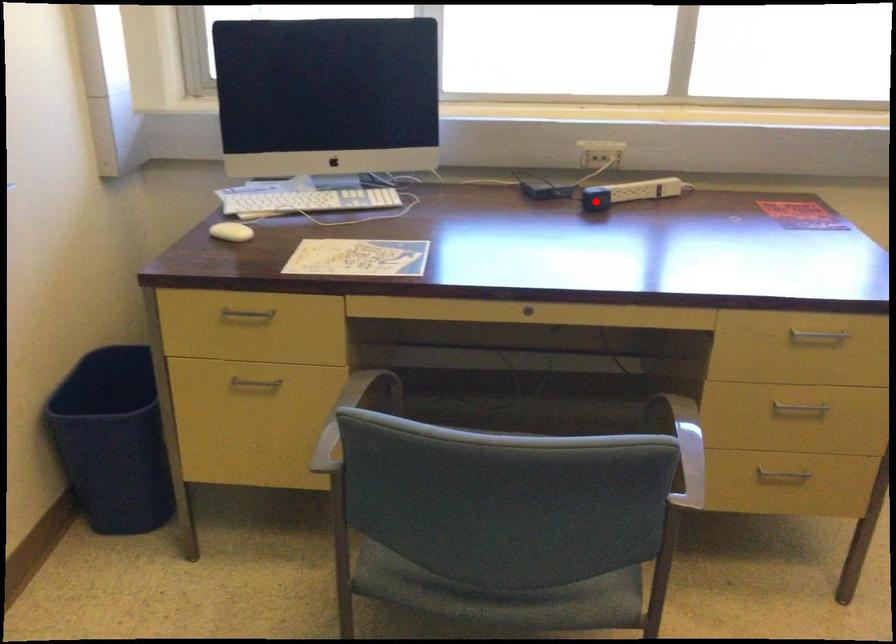
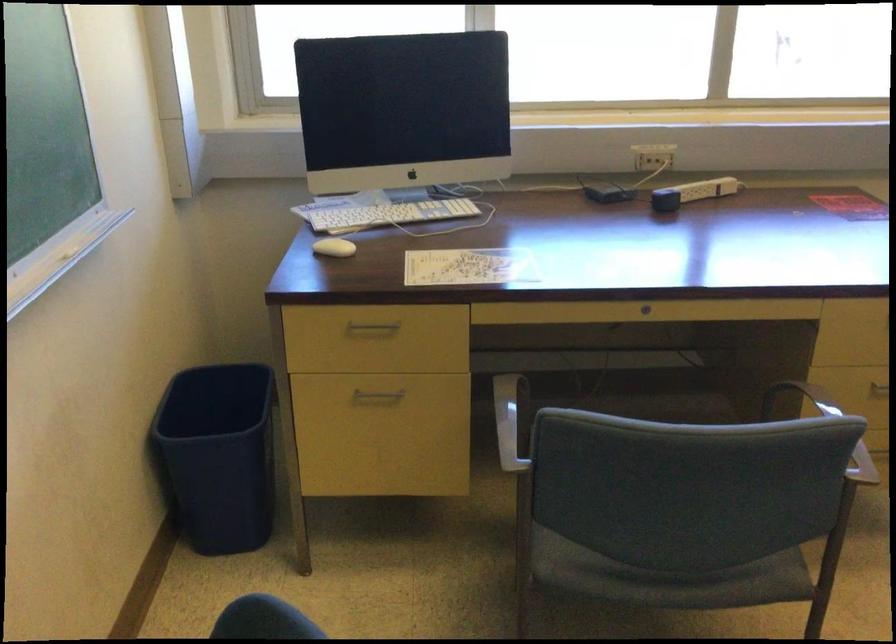
Where in the second image is the point corresponding to the highlighted location from the first image?

(665, 200)